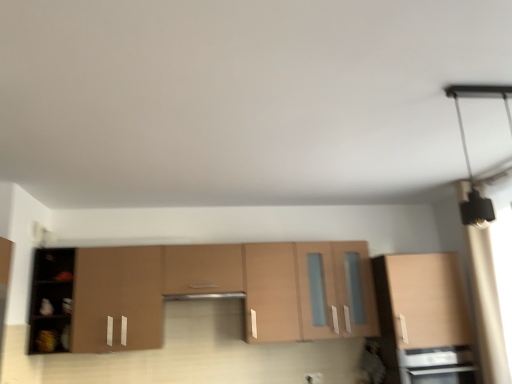
Question: Is matte brown cabinet at center, placed as the first cabinetry when sorted from left to right, smaller than matte wood cabinet at right, acting as the 1th cabinetry starting from the right?

Choices:
 (A) no
 (B) yes

Answer: (A)

Question: Is matte brown cabinet at center, which is the 2th cabinetry from right to left, facing towards matte wood cabinet at right, the second cabinetry in the left-to-right sequence?

Choices:
 (A) no
 (B) yes

Answer: (A)

Question: Is matte brown cabinet at center, which is the 2th cabinetry from right to left, not close to matte wood cabinet at right, the second cabinetry in the left-to-right sequence?

Choices:
 (A) yes
 (B) no

Answer: (B)

Question: Is matte wood cabinet at right, acting as the 1th cabinetry starting from the right, located within matte brown cabinet at center, placed as the first cabinetry when sorted from left to right?

Choices:
 (A) yes
 (B) no

Answer: (B)

Question: Is the position of matte brown cabinet at center, which is the 2th cabinetry from right to left, less distant than that of matte wood cabinet at right, the second cabinetry in the left-to-right sequence?

Choices:
 (A) no
 (B) yes

Answer: (B)

Question: From the image's perspective, is black matte light fixture at upper right positioned above or below matte brown cabinet at center, which is the 2th cabinetry from right to left?

Choices:
 (A) above
 (B) below

Answer: (A)

Question: From a real-world perspective, is black matte light fixture at upper right positioned above or below matte brown cabinet at center, placed as the first cabinetry when sorted from left to right?

Choices:
 (A) above
 (B) below

Answer: (A)

Question: Based on their positions, is black matte light fixture at upper right located to the left or right of matte brown cabinet at center, placed as the first cabinetry when sorted from left to right?

Choices:
 (A) right
 (B) left

Answer: (A)

Question: Is black matte light fixture at upper right taller or shorter than matte brown cabinet at center, placed as the first cabinetry when sorted from left to right?

Choices:
 (A) tall
 (B) short

Answer: (B)

Question: From the image's perspective, is matte wood cabinet at right, acting as the 1th cabinetry starting from the right, above or below matte brown cabinet at center, which is the 2th cabinetry from right to left?

Choices:
 (A) below
 (B) above

Answer: (A)

Question: In the image, is matte wood cabinet at right, the second cabinetry in the left-to-right sequence, positioned in front of or behind matte brown cabinet at center, which is the 2th cabinetry from right to left?

Choices:
 (A) behind
 (B) front

Answer: (A)

Question: Choose the correct answer: Is matte wood cabinet at right, acting as the 1th cabinetry starting from the right, inside matte brown cabinet at center, placed as the first cabinetry when sorted from left to right, or outside it?

Choices:
 (A) outside
 (B) inside

Answer: (A)

Question: From a real-world perspective, is matte wood cabinet at right, acting as the 1th cabinetry starting from the right, above or below matte brown cabinet at center, which is the 2th cabinetry from right to left?

Choices:
 (A) above
 (B) below

Answer: (B)

Question: From a real-world perspective, is matte brown cabinet at center, which is the 2th cabinetry from right to left, positioned above or below matte wood cabinet at right, the second cabinetry in the left-to-right sequence?

Choices:
 (A) below
 (B) above

Answer: (B)

Question: Considering the positions of matte brown cabinet at center, placed as the first cabinetry when sorted from left to right, and matte wood cabinet at right, the second cabinetry in the left-to-right sequence, in the image, is matte brown cabinet at center, placed as the first cabinetry when sorted from left to right, wider or thinner than matte wood cabinet at right, the second cabinetry in the left-to-right sequence,?

Choices:
 (A) wide
 (B) thin

Answer: (B)